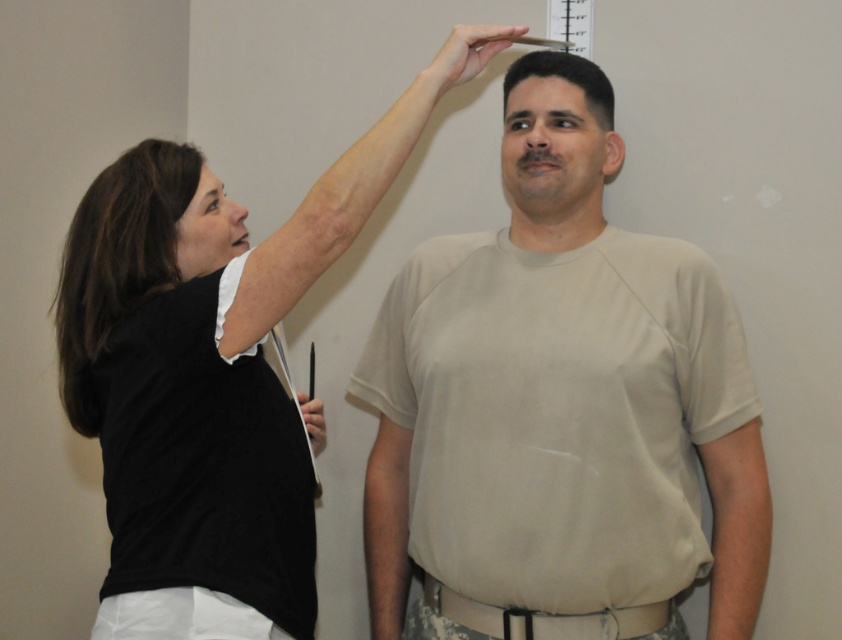
In the medical setting scene, you need to determine which object is taller between the black matte shirt at upper left and the black fabric belt at center. Based on their positions, which one is taller?

The black matte shirt at upper left is much taller than the black fabric belt at center according to the description.

You are a healthcare professional in the scene and need to adjust the position of the beige cotton shirt at center and the black fabric belt at center so that the belt is now on the left side of the shirt. Is this possible without moving the shirt?

The beige cotton shirt at center is currently to the right of the black fabric belt at center. To move the belt to the left of the shirt without moving the shirt, you would need to shift the belt to the left side of the shirt. Since the shirt is fixed in position, moving the belt to the left of it is possible as long as there is enough space available in the scene to reposition the belt accordingly.